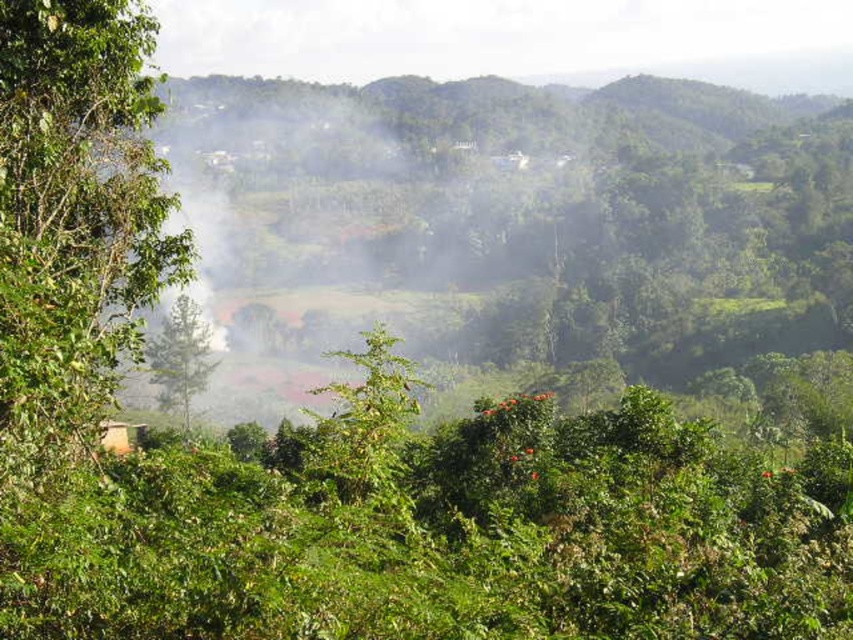
Question: Which point is farther from the camera taking this photo?

Choices:
 (A) (125, 428)
 (B) (167, 320)

Answer: (B)

Question: Which point is closer to the camera?

Choices:
 (A) green leafy tree at left
 (B) green matte tree at center
 (C) wooden hut at lower left

Answer: (A)

Question: From the image, what is the correct spatial relationship of green matte tree at center in relation to wooden hut at lower left?

Choices:
 (A) right
 (B) left

Answer: (B)

Question: Which of these objects is positioned closest to the green matte tree at center?

Choices:
 (A) green leafy tree at left
 (B) wooden hut at lower left

Answer: (B)

Question: Can you confirm if green matte tree at center is smaller than wooden hut at lower left?

Choices:
 (A) yes
 (B) no

Answer: (B)

Question: Does green matte tree at center come behind wooden hut at lower left?

Choices:
 (A) yes
 (B) no

Answer: (A)